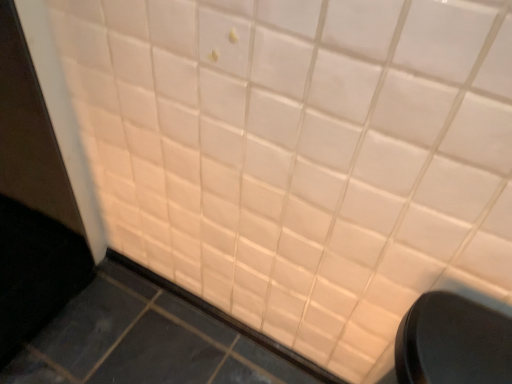
This screenshot has height=384, width=512. Describe the element at coordinates (453, 342) in the screenshot. I see `black matte trash can at lower right` at that location.

Where is `black matte trash can at lower right`? black matte trash can at lower right is located at coordinates [x=453, y=342].

Locate an element on the screen. The image size is (512, 384). black matte trash can at lower right is located at coordinates (453, 342).